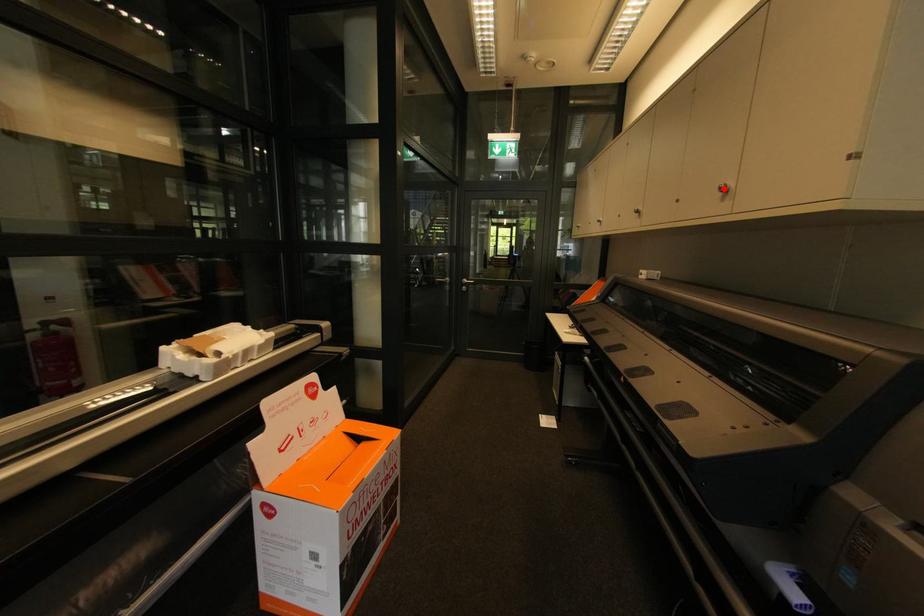
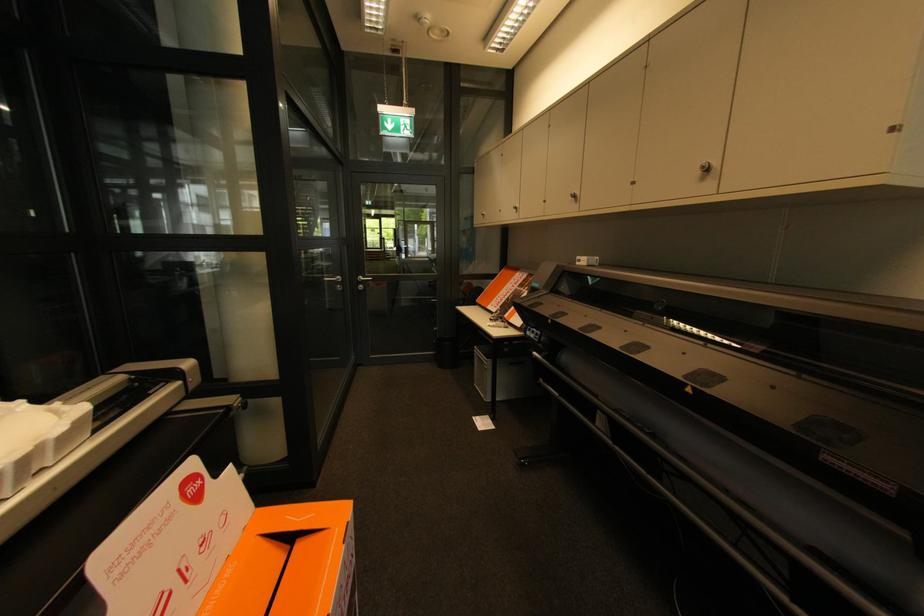
Find the pixel in the second image that matches the highlighted location in the first image.

(707, 168)